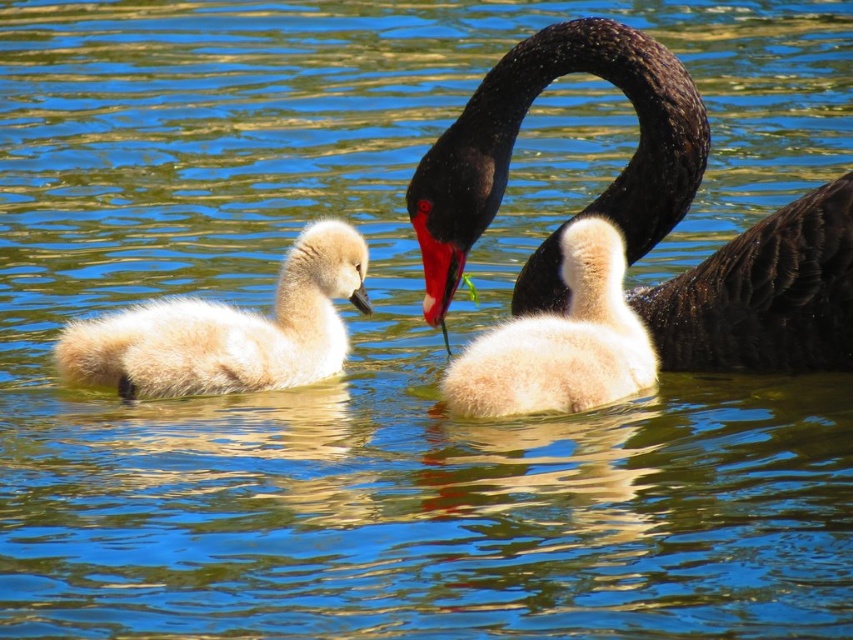
Question: Which object is positioned farthest from the fluffy white cygnet at center?

Choices:
 (A) shiny black swan at center
 (B) white fluffy swan at left

Answer: (B)

Question: Is shiny black swan at center above fluffy white cygnet at center?

Choices:
 (A) no
 (B) yes

Answer: (B)

Question: Can you confirm if white fluffy swan at left is thinner than fluffy white cygnet at center?

Choices:
 (A) yes
 (B) no

Answer: (B)

Question: Considering the relative positions of shiny black swan at center and white fluffy swan at left in the image provided, where is shiny black swan at center located with respect to white fluffy swan at left?

Choices:
 (A) right
 (B) left

Answer: (A)

Question: Which of the following is the closest to the observer?

Choices:
 (A) (601, 401)
 (B) (122, 356)
 (C) (735, 240)

Answer: (A)

Question: Estimate the real-world distances between objects in this image. Which object is farther from the shiny black swan at center?

Choices:
 (A) fluffy white cygnet at center
 (B) white fluffy swan at left

Answer: (B)